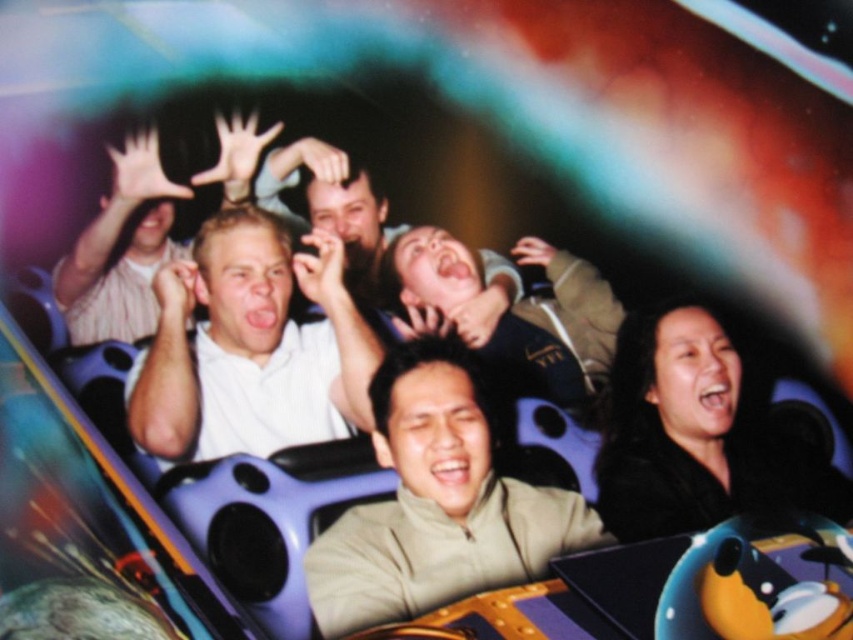
Which is in front, point (363, 604) or point (202, 385)?

Point (363, 604) is more forward.

Is point (403, 461) behind point (260, 228)?

No, it is not.

Locate an element on the screen. The width and height of the screenshot is (853, 640). tan matte jacket at center is located at coordinates (437, 502).

Is the position of tan matte jacket at center less distant than that of smooth skin face at center?

Yes, tan matte jacket at center is in front of smooth skin face at center.

Who is shorter, tan matte jacket at center or smooth skin face at center?

tan matte jacket at center

The width and height of the screenshot is (853, 640). Identify the location of tan matte jacket at center. (437, 502).

Is point (544, 326) closer to camera compared to point (337, 163)?

That is True.

Image resolution: width=853 pixels, height=640 pixels. Describe the element at coordinates (512, 310) in the screenshot. I see `matte khaki shirt at center` at that location.

The image size is (853, 640). I want to click on matte khaki shirt at center, so (512, 310).